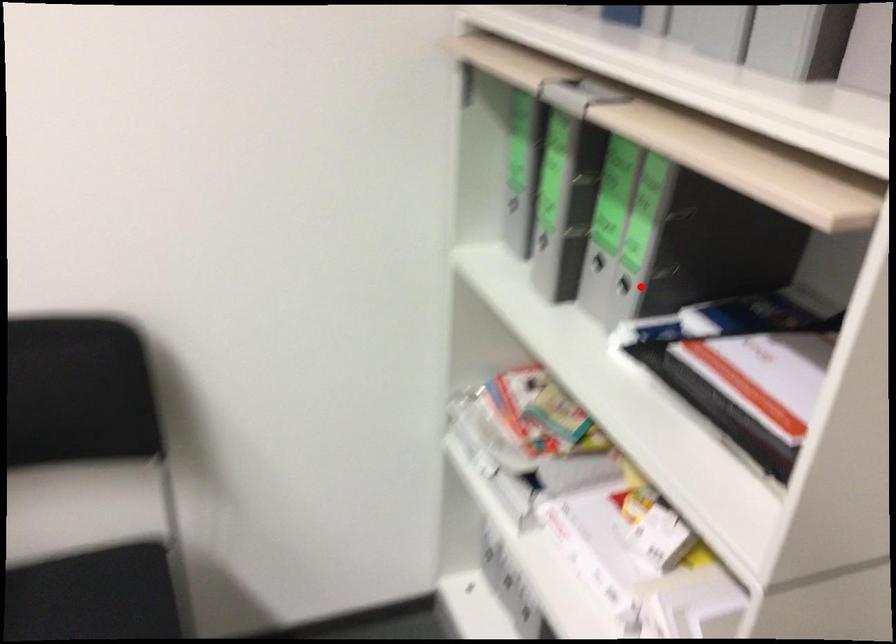
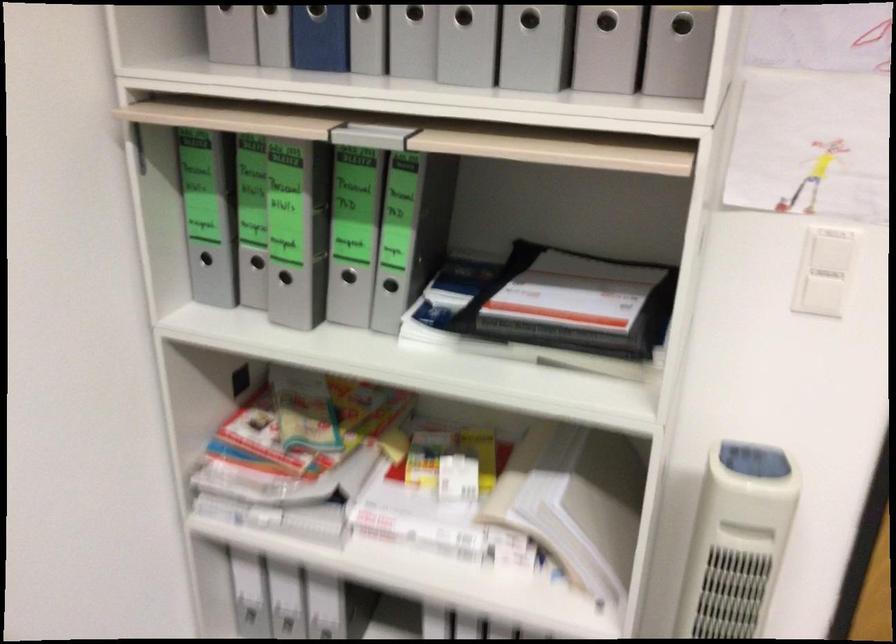
The point at the highlighted location is marked in the first image. Where is the corresponding point in the second image?

(390, 285)